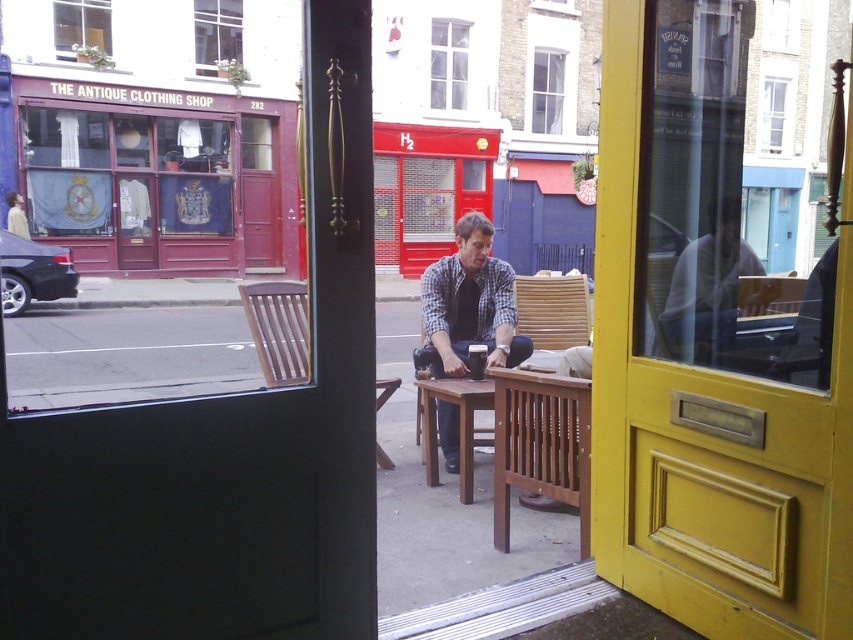
You are standing inside the building with the yellow door frame and want to exit to the street. You see the red wood antique clothing shop at left and the brown wooden chair at center. Which object is closer to you as you look through the glass doors?

The red wood antique clothing shop at left is closer to you than the brown wooden chair at center because the brown wooden chair at center is positioned behind the red wood antique clothing shop at left.

You are standing inside the building with the yellow door frame and want to sit down at the brown wooden table at center. However, there is a light brown wooden chair at left nearby. Can you sit on the chair and reach the table comfortably?

The brown wooden table at center is positioned under the light brown wooden chair at left, meaning the table is directly beneath the chair. This arrangement would make it impossible to sit on the chair and reach the table comfortably as they are stacked vertically rather than placed side by side.

From the picture: You are standing inside the building with the yellow door frame and looking out through the glass doors. You see the red wood antique clothing shop at left and the brown wooden chair at center. Which object is positioned higher in the scene?

The red wood antique clothing shop at left is positioned higher than the brown wooden chair at center in the scene.